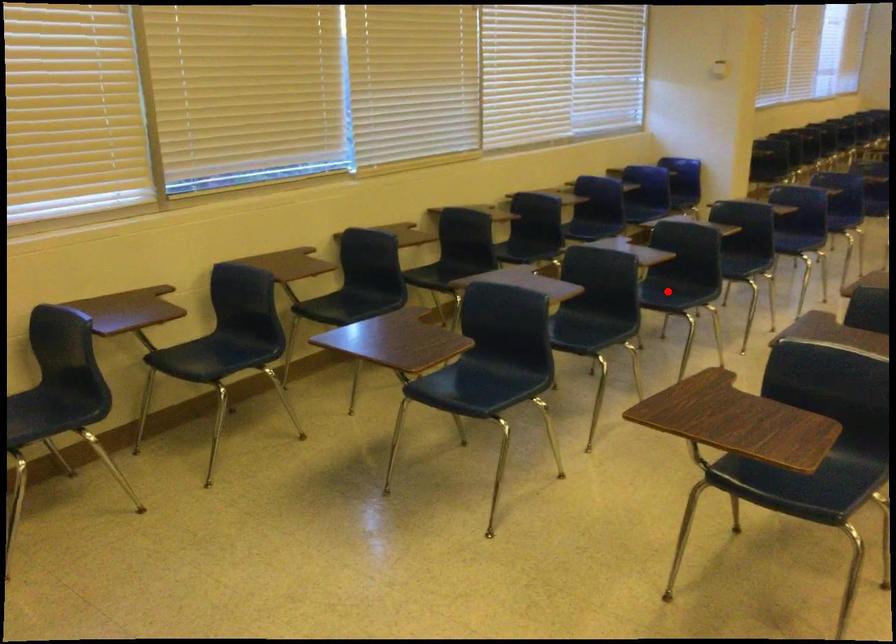
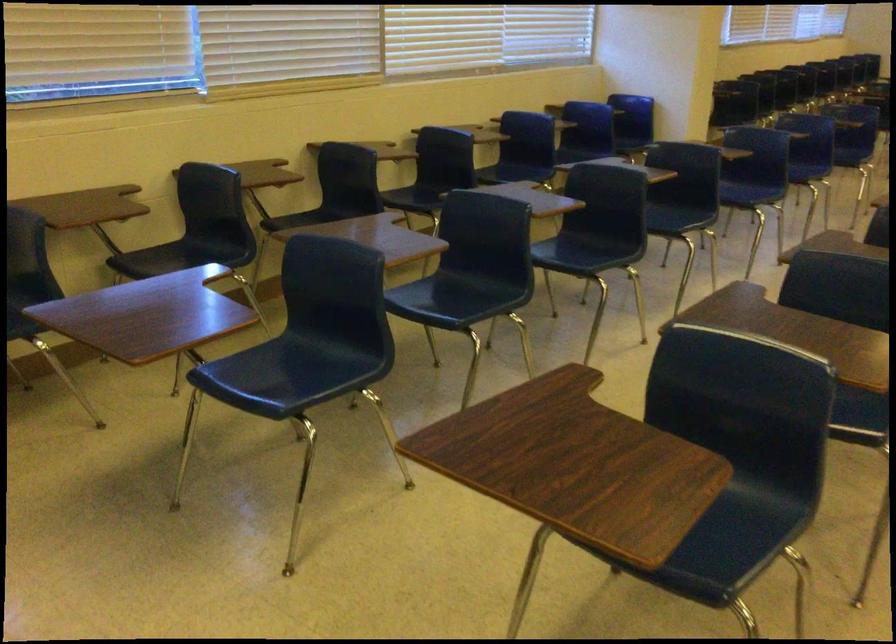
Question: I am providing you with two images of the same scene from different viewpoints. In image1, a red point is highlighted. Considering the same 3D point in image2, which of the following is correct?

Choices:
 (A) It is closer
 (B) It is farther

Answer: (A)